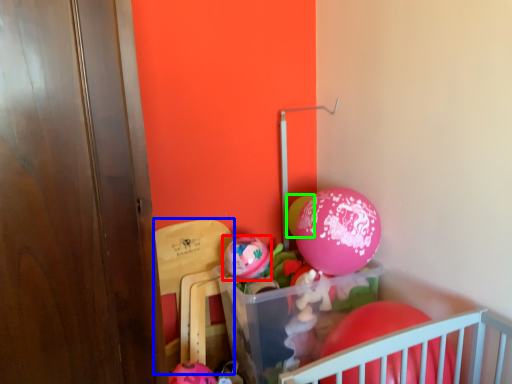
Question: Estimate the real-world distances between objects in this image. Which object is closer to balloon (highlighted by a red box), armchair (highlighted by a blue box) or balloon (highlighted by a green box)?

Choices:
 (A) armchair
 (B) balloon

Answer: (A)